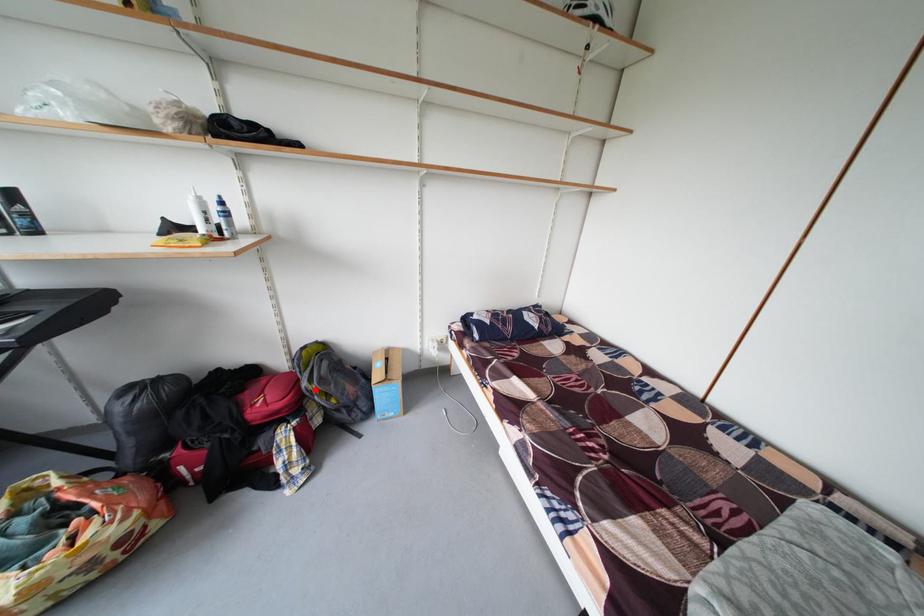
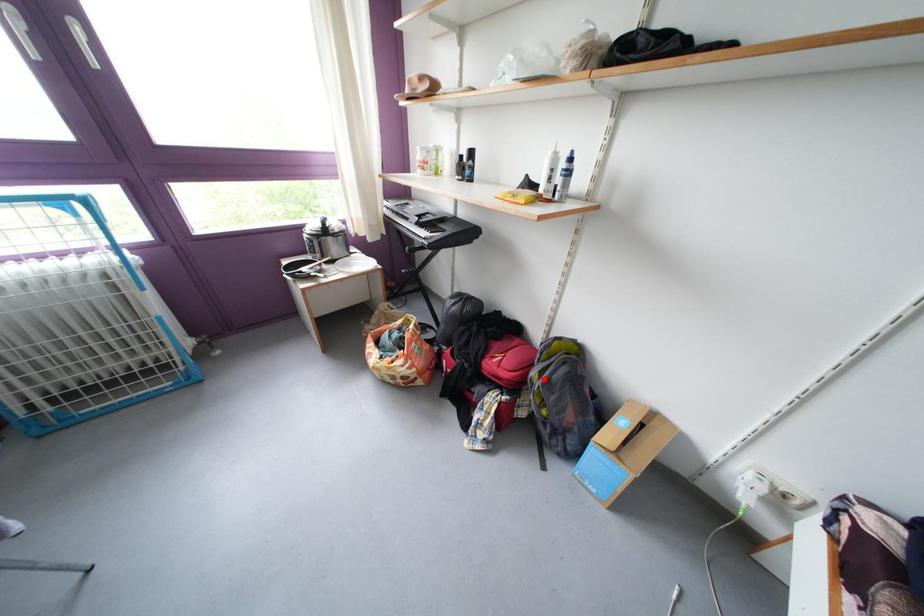
I am providing you with two images of the same scene from different viewpoints. A red point is marked on the first image and another point is marked on the second image. Are the points marked in image1 and image2 representing the same 3D position?

Yes